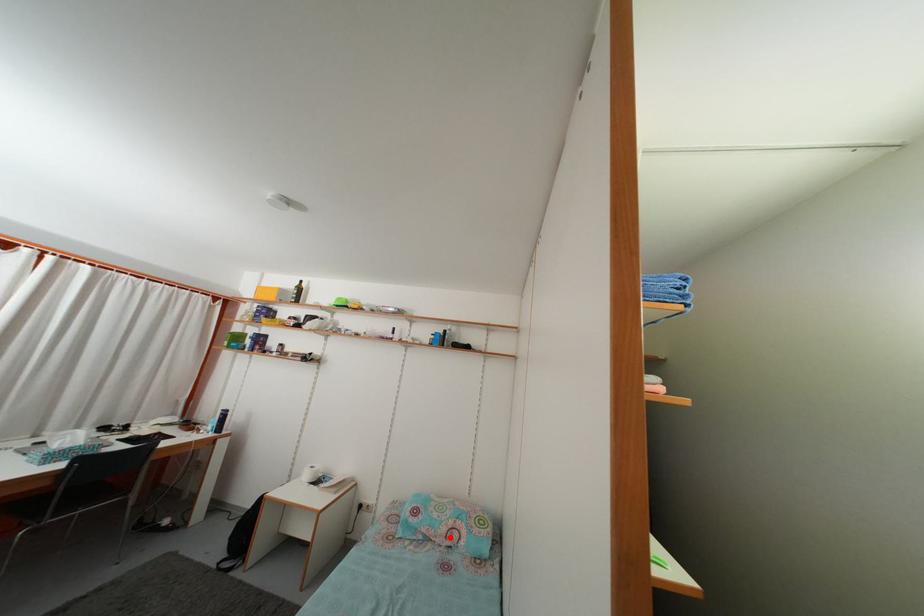
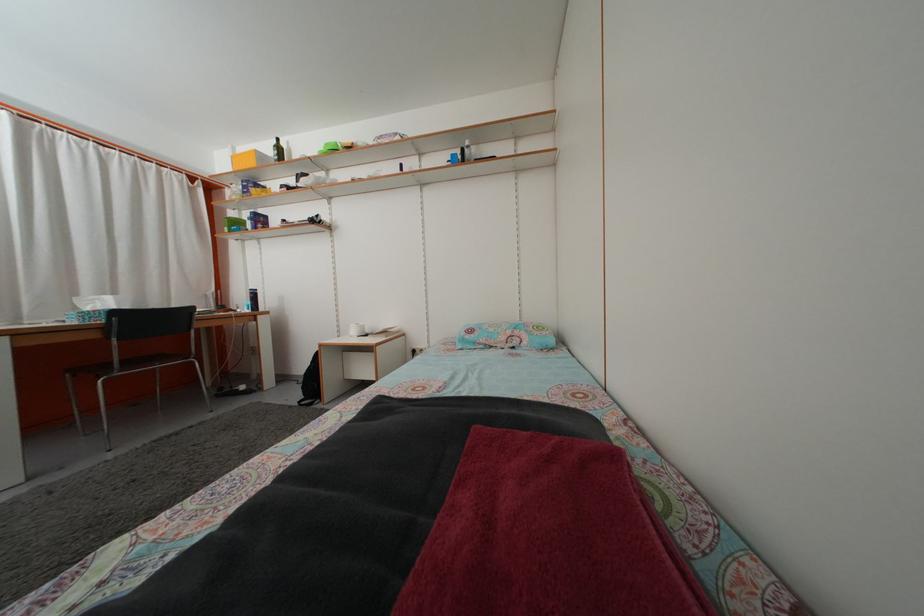
Question: I am providing you with two images of the same scene from different viewpoints. Image1 has a red point marked. In image2, the corresponding 3D location appears at what relative position? Reply with the corresponding letter.

Choices:
 (A) Closer
 (B) Farther

Answer: (A)